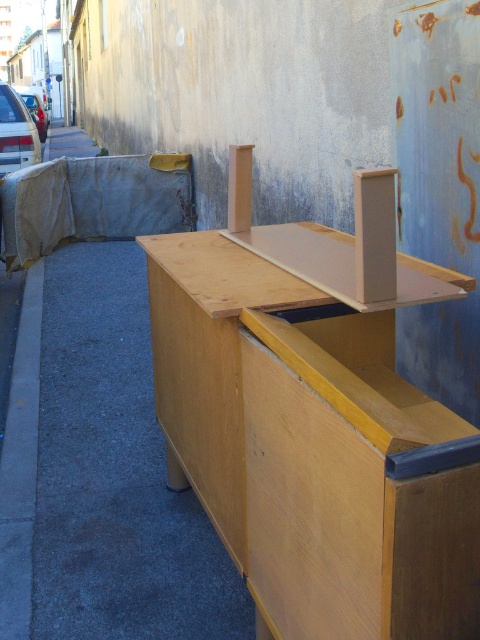
Question: Which point is closer to the camera?

Choices:
 (A) light brown wood table at center
 (B) wooden bench at right

Answer: (A)

Question: Which object appears closest to the camera in this image?

Choices:
 (A) wooden bench at right
 (B) light brown wood table at center

Answer: (B)

Question: Does light brown wood table at center have a lesser width compared to wooden bench at right?

Choices:
 (A) yes
 (B) no

Answer: (B)

Question: Can you confirm if light brown wood table at center is smaller than wooden bench at right?

Choices:
 (A) no
 (B) yes

Answer: (A)

Question: Is light brown wood table at center positioned behind wooden bench at right?

Choices:
 (A) yes
 (B) no

Answer: (B)